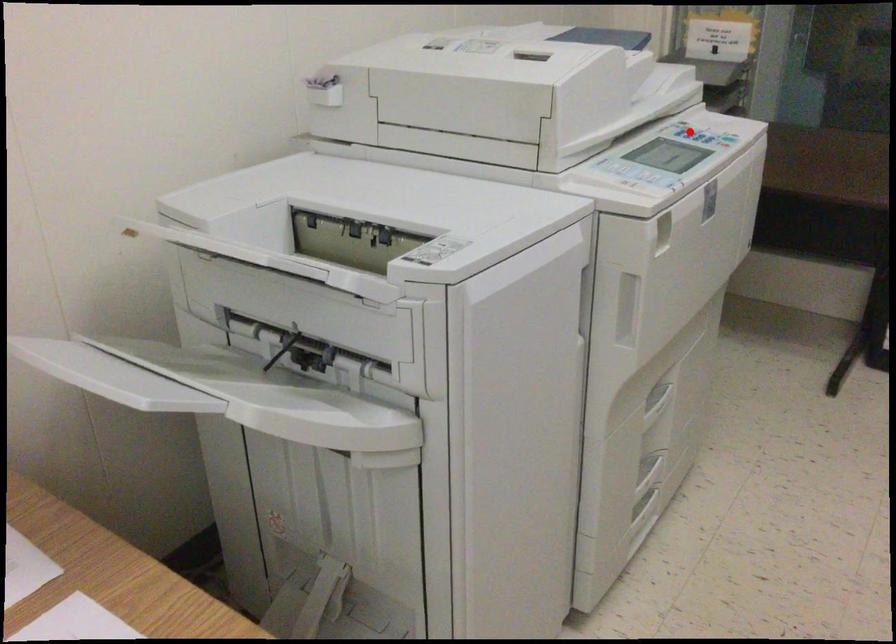
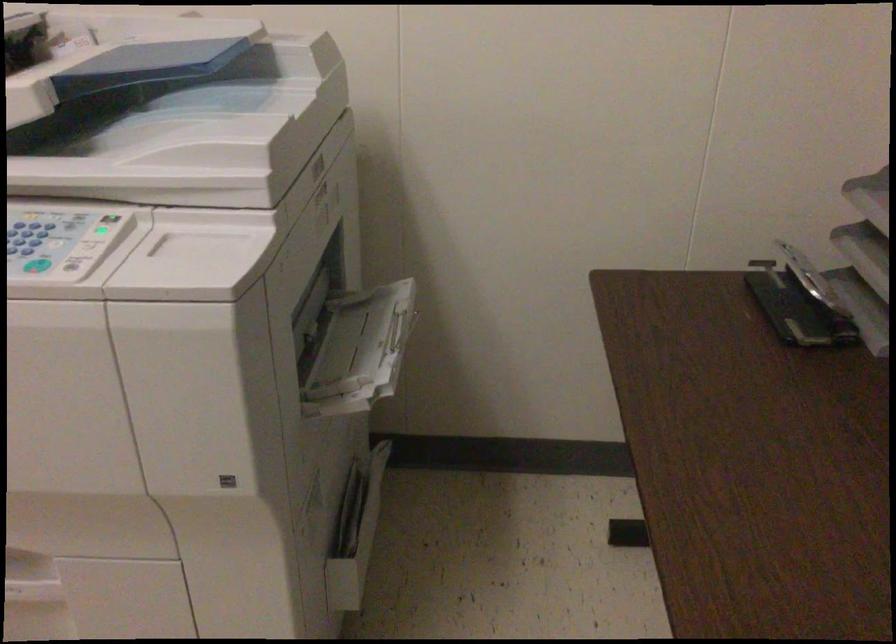
Find the pixel in the second image that matches the highlighted location in the first image.

(92, 241)